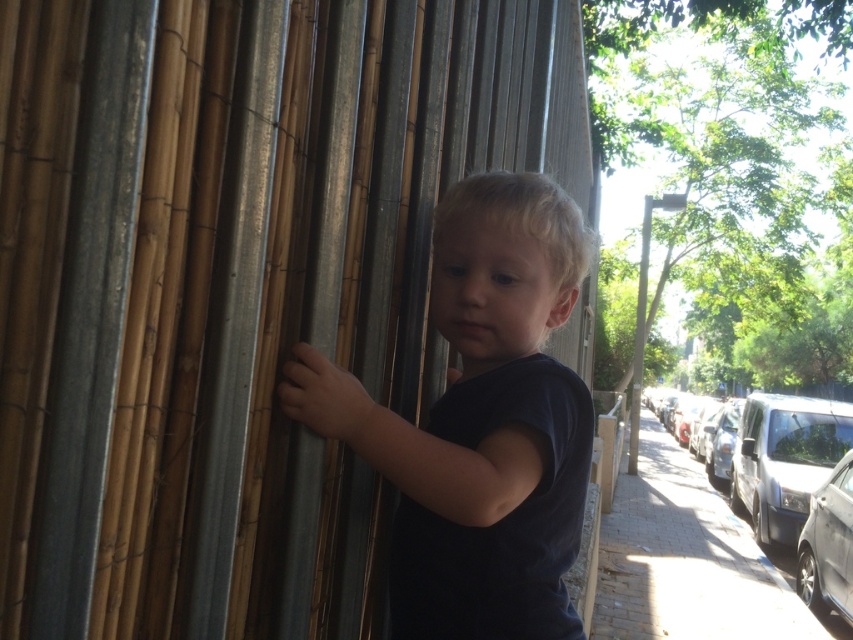
You are a photographer trying to capture a photo of the natural bamboo forest at center and the dark blue shirt at center. The camera you are using has a maximum focus range of 7 inches. Can you focus on both objects simultaneously?

The natural bamboo forest at center and dark blue shirt at center are 7.10 inches apart. Since the distance between them exceeds the camera maximum focus range of 7 inches, you cannot focus on both objects simultaneously.

You are a photographer trying to capture the natural bamboo forest at center and dark blue shirt at center in a single frame. Based on their widths, which object should you prioritize framing closer to avoid being too small in the photo?

The dark blue shirt at center should be prioritized closer because the natural bamboo forest at center is wider, so it will naturally appear larger in the frame even from a distance, whereas the narrower dark blue shirt at center might become too small if not framed closer.

You are a photographer trying to capture the natural bamboo forest at center and the dark blue shirt at center in the same frame. Based on their positions, which object should you focus on first to ensure both are in the frame?

The natural bamboo forest at center is located above the dark blue shirt at center, so you should focus on the dark blue shirt at center first to ensure both are in the frame.